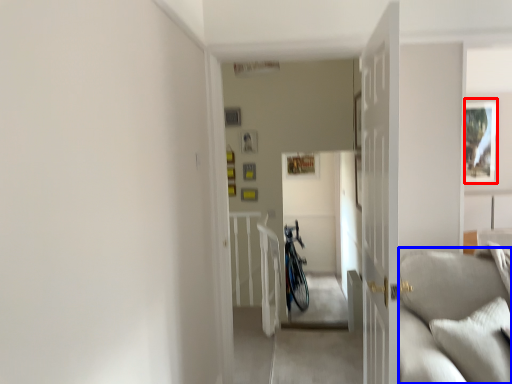
Question: Which object is further to the camera taking this photo, picture frame (highlighted by a red box) or couch (highlighted by a blue box)?

Choices:
 (A) picture frame
 (B) couch

Answer: (A)